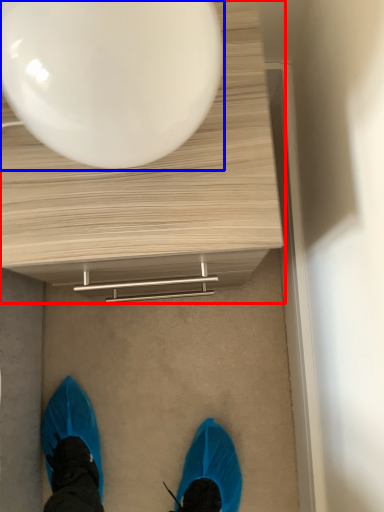
Question: Which point is further to the camera, table (highlighted by a red box) or balloon (highlighted by a blue box)?

Choices:
 (A) table
 (B) balloon

Answer: (A)